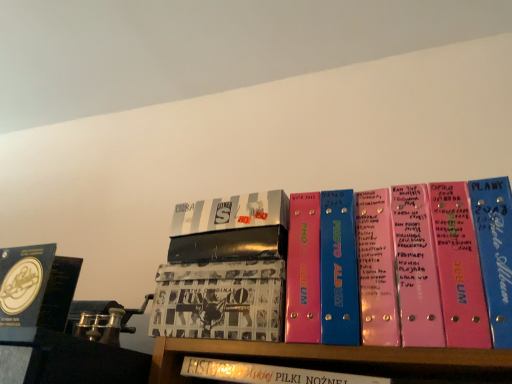
Question: Are white leather book at center, the 4th book from the left, and pink plastic photo album at center, the 1th book viewed from the right, far apart?

Choices:
 (A) no
 (B) yes

Answer: (A)

Question: Is white leather book at center, the 4th book from the left, completely or partially outside of pink plastic photo album at center, acting as the 5th book starting from the left?

Choices:
 (A) no
 (B) yes

Answer: (B)

Question: Is white leather book at center, acting as the 2th book starting from the right, further to camera compared to pink plastic photo album at center, acting as the 5th book starting from the left?

Choices:
 (A) yes
 (B) no

Answer: (A)

Question: Can pink plastic photo album at center, acting as the 5th book starting from the left, be found inside white leather book at center, acting as the 2th book starting from the right?

Choices:
 (A) yes
 (B) no

Answer: (B)

Question: Can you confirm if white leather book at center, the 4th book from the left, is positioned to the left of pink plastic photo album at center, acting as the 5th book starting from the left?

Choices:
 (A) no
 (B) yes

Answer: (B)

Question: Considering the positions of printed paper album at center, arranged as the fourth book when viewed from the right, and blue matte album at left, marked as the fifth book in a right-to-left arrangement, in the image, is printed paper album at center, arranged as the fourth book when viewed from the right, bigger or smaller than blue matte album at left, marked as the fifth book in a right-to-left arrangement,?

Choices:
 (A) big
 (B) small

Answer: (A)

Question: From a real-world perspective, is printed paper album at center, arranged as the fourth book when viewed from the right, positioned above or below blue matte album at left, marked as the fifth book in a right-to-left arrangement?

Choices:
 (A) below
 (B) above

Answer: (A)

Question: Considering the positions of printed paper album at center, arranged as the fourth book when viewed from the right, and blue matte album at left, marked as the fifth book in a right-to-left arrangement, in the image, is printed paper album at center, arranged as the fourth book when viewed from the right, wider or thinner than blue matte album at left, marked as the fifth book in a right-to-left arrangement,?

Choices:
 (A) wide
 (B) thin

Answer: (A)

Question: Is printed paper album at center, arranged as the fourth book when viewed from the right, to the left or to the right of blue matte album at left, marked as the fifth book in a right-to-left arrangement, in the image?

Choices:
 (A) left
 (B) right

Answer: (B)

Question: Is white leather book at center, acting as the 2th book starting from the right, bigger or smaller than metallic silver photo album at center, acting as the third book starting from the right?

Choices:
 (A) small
 (B) big

Answer: (B)

Question: Considering their positions, is white leather book at center, the 4th book from the left, located in front of or behind metallic silver photo album at center, acting as the third book starting from the right?

Choices:
 (A) behind
 (B) front

Answer: (B)

Question: From a real-world perspective, is white leather book at center, the 4th book from the left, above or below metallic silver photo album at center, the third book positioned from the left?

Choices:
 (A) above
 (B) below

Answer: (B)

Question: In terms of height, does white leather book at center, the 4th book from the left, look taller or shorter compared to metallic silver photo album at center, acting as the third book starting from the right?

Choices:
 (A) short
 (B) tall

Answer: (A)

Question: Is blue matte album at left, marked as the fifth book in a right-to-left arrangement, taller or shorter than metallic silver photo album at center, the third book positioned from the left?

Choices:
 (A) tall
 (B) short

Answer: (A)

Question: Is point (52, 256) closer or farther from the camera than point (244, 198)?

Choices:
 (A) farther
 (B) closer

Answer: (A)